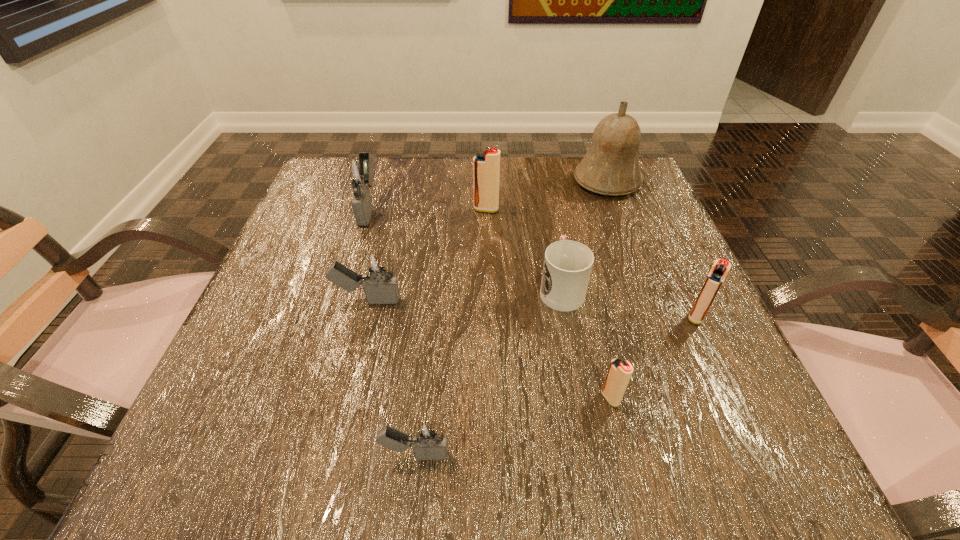
I want to click on the rightmost gray igniter, so click(428, 439).

I want to click on the nearest igniter, so click(x=428, y=439).

At what (x,y) coordinates should I click in order to perform the action: click on free space located on the front of the bell. Please return your answer as a coordinate pair (x, y). Image resolution: width=960 pixels, height=540 pixels. Looking at the image, I should click on (661, 325).

Image resolution: width=960 pixels, height=540 pixels. In order to click on vacant space located on the left of the fourth igniter from left to right in this screenshot , I will do `click(393, 210)`.

I want to click on vacant space positioned 0.370m on the front of the farthest gray igniter, so click(x=316, y=376).

Image resolution: width=960 pixels, height=540 pixels. Find the location of `vacant space positioned on the right of the second biggest gray igniter`. vacant space positioned on the right of the second biggest gray igniter is located at coordinates (585, 300).

Find the location of a particular element. vacant point located on the back of the second nearest red igniter is located at coordinates (639, 193).

At what (x,y) coordinates should I click in order to perform the action: click on vacant region located 0.330m on the side of the cup where the handle is located. Please return your answer as a coordinate pair (x, y). This screenshot has width=960, height=540. Looking at the image, I should click on (540, 176).

Identify the location of free spot located 0.290m on the side of the cup where the handle is located. (542, 185).

The width and height of the screenshot is (960, 540). What are the coordinates of `free point located on the side of the cup where the handle is located` in the screenshot? It's located at (546, 209).